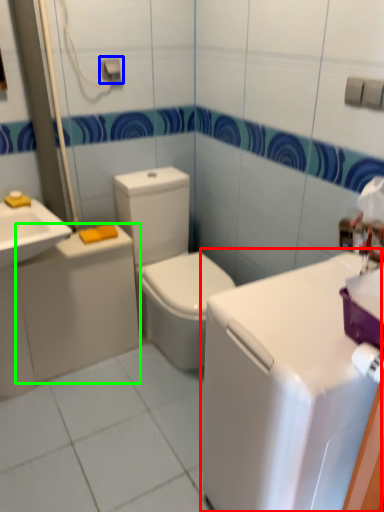
Question: Which object is positioned closest to counter top (highlighted by a red box)? Select from towel bar (highlighted by a blue box) and appliance (highlighted by a green box).

Choices:
 (A) towel bar
 (B) appliance

Answer: (B)